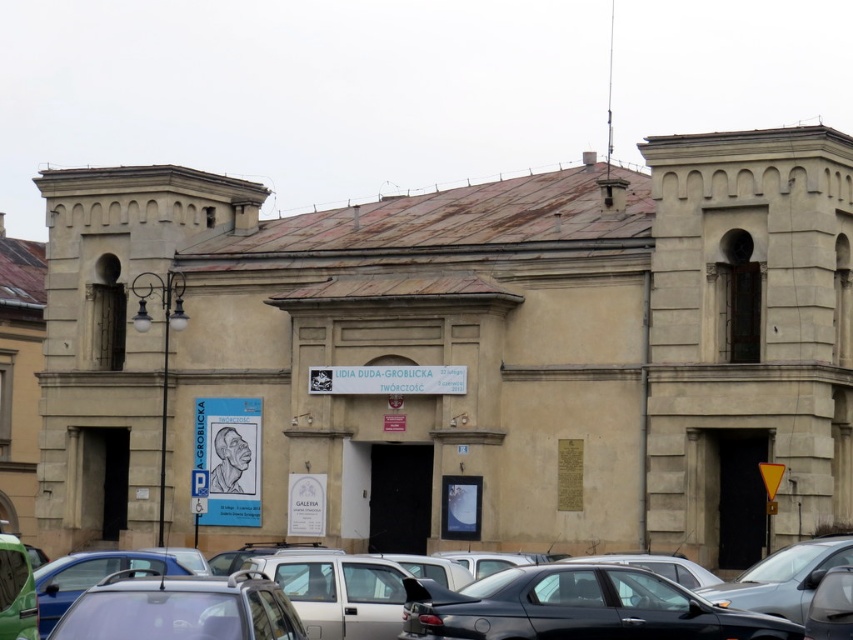
Who is shorter, satin silver car at lower center or metallic gray car at lower right?

satin silver car at lower center

Is satin silver car at lower center to the left of metallic gray car at lower right from the viewer's perspective?

Indeed, satin silver car at lower center is positioned on the left side of metallic gray car at lower right.

Is point (187, 595) farther from camera compared to point (795, 584)?

That is False.

Locate an element on the screen. This screenshot has width=853, height=640. satin silver car at lower center is located at coordinates (181, 609).

Can you confirm if metallic gray cars at lower center is positioned below satin silver car at lower center?

Indeed, metallic gray cars at lower center is positioned under satin silver car at lower center.

Does metallic gray cars at lower center have a greater height compared to satin silver car at lower center?

Indeed, metallic gray cars at lower center has a greater height compared to satin silver car at lower center.

Find the location of a particular element. metallic gray cars at lower center is located at coordinates (575, 609).

Which is above, black matte car at lower center or metallic gray car at lower right?

black matte car at lower center is higher up.

Which is in front, point (619, 593) or point (801, 602)?

Point (619, 593)

I want to click on black matte car at lower center, so click(578, 608).